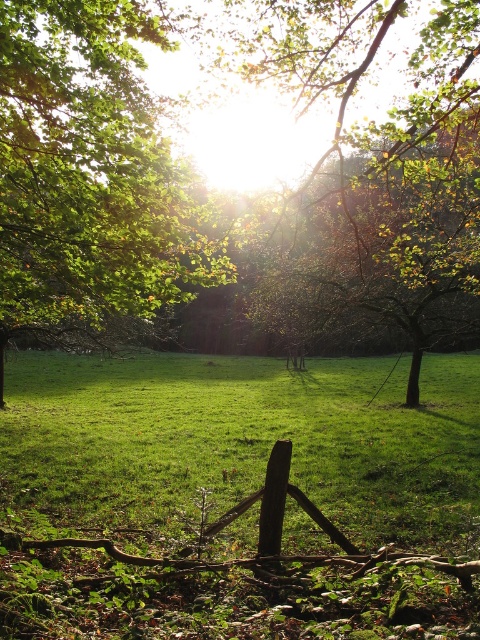
Question: Which object is positioned farthest from the green grassy field at center?

Choices:
 (A) brown wood fence at center
 (B) green leafy tree at upper left

Answer: (A)

Question: Which object is farther from the camera taking this photo?

Choices:
 (A) green leafy tree at upper left
 (B) brown wood fence at center
 (C) green grassy field at center

Answer: (A)

Question: Does green grassy field at center appear on the right side of green leafy tree at upper left?

Choices:
 (A) yes
 (B) no

Answer: (A)

Question: Which point is closer to the camera?

Choices:
 (A) green grassy field at center
 (B) brown wood fence at center

Answer: (B)

Question: Is green grassy field at center bigger than brown wood fence at center?

Choices:
 (A) yes
 (B) no

Answer: (A)

Question: Does green grassy field at center have a lesser width compared to brown wood fence at center?

Choices:
 (A) yes
 (B) no

Answer: (B)